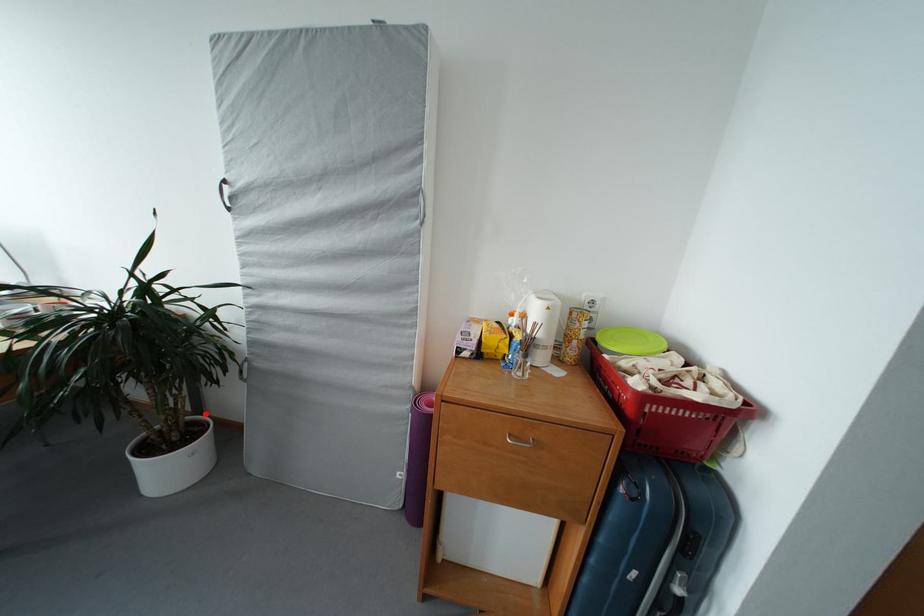
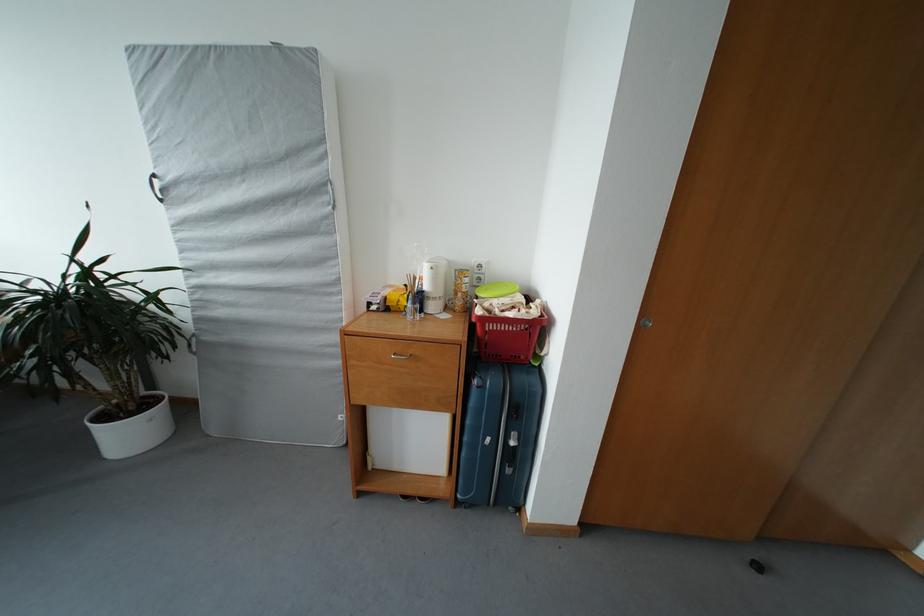
Question: I am providing you with two images of the same scene from different viewpoints. In image1, a red point is highlighted. Considering the same 3D point in image2, which of the following is correct?

Choices:
 (A) It is closer
 (B) It is farther

Answer: (A)